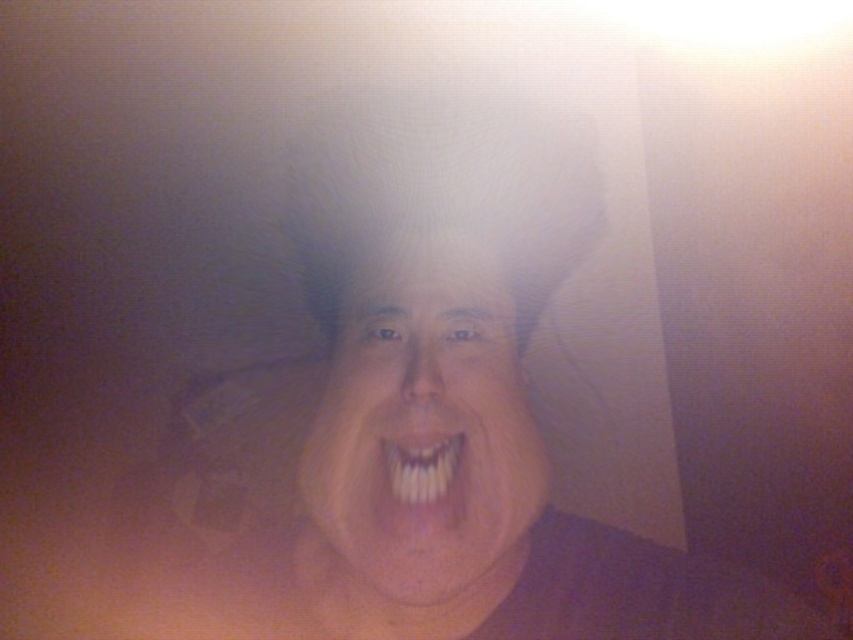
You are a photographer trying to capture a closeup portrait of a person with their mouth open. You want to ensure that the white glossy face at center and the white glossy teeth at center are spaced exactly 4 centimeters apart in the final image. Based on the scene description, can you achieve this requirement?

The white glossy face at center and white glossy teeth at center are 4.14 centimeters apart, so the spacing is slightly more than 4 centimeters. Therefore, the requirement of exactly 4 centimeters cannot be met with the current setup.

You are holding a small flashlight that is 6 inches wide. You want to shine it on the point at coordinates point (387,406). If you hold the flashlight at arm length, which is 24 inches away from your eyes, will the flashlight cover the point completely?

The point point (387,406) is 17.81 inches away from the viewer. Since the flashlight is held at 24 inches, which is farther than the point, the flashlight cannot reach the point and therefore cannot cover it completely.